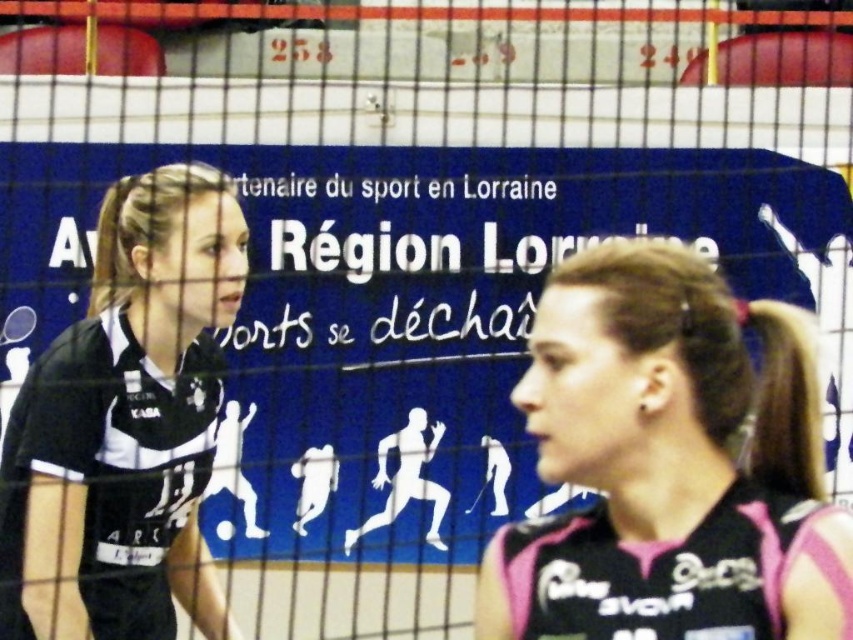
Which of these two, pink jersey at right or black jersey at left, stands shorter?

Standing shorter between the two is pink jersey at right.

Who is taller, pink jersey at right or black jersey at left?

Standing taller between the two is black jersey at left.

Identify the location of pink jersey at right. (668, 456).